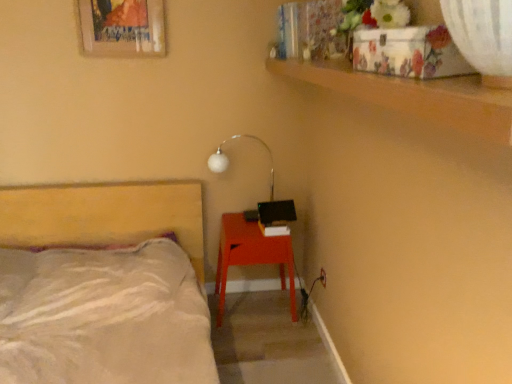
Question: Is wooden picture frame at upper left not within white glossy lamp at upper center?

Choices:
 (A) yes
 (B) no

Answer: (A)

Question: Can you confirm if wooden picture frame at upper left is taller than white glossy lamp at upper center?

Choices:
 (A) yes
 (B) no

Answer: (B)

Question: Is wooden picture frame at upper left in front of white glossy lamp at upper center?

Choices:
 (A) no
 (B) yes

Answer: (B)

Question: From a real-world perspective, is wooden picture frame at upper left on white glossy lamp at upper center?

Choices:
 (A) no
 (B) yes

Answer: (B)

Question: From the image's perspective, is wooden picture frame at upper left located beneath white glossy lamp at upper center?

Choices:
 (A) no
 (B) yes

Answer: (A)

Question: Is white glossy lamp at upper center wider or thinner than beige fabric bed at left?

Choices:
 (A) thin
 (B) wide

Answer: (A)

Question: Is white glossy lamp at upper center situated inside beige fabric bed at left or outside?

Choices:
 (A) outside
 (B) inside

Answer: (A)

Question: Is point (223, 163) closer or farther from the camera than point (177, 281)?

Choices:
 (A) farther
 (B) closer

Answer: (A)

Question: From the image's perspective, relative to beige fabric bed at left, is white glossy lamp at upper center above or below?

Choices:
 (A) below
 (B) above

Answer: (B)

Question: Considering the positions of matte red nightstand at lower right and beige fabric bed at left in the image, is matte red nightstand at lower right bigger or smaller than beige fabric bed at left?

Choices:
 (A) small
 (B) big

Answer: (A)

Question: From a real-world perspective, relative to beige fabric bed at left, is matte red nightstand at lower right vertically above or below?

Choices:
 (A) above
 (B) below

Answer: (B)

Question: From the image's perspective, is matte red nightstand at lower right located above or below beige fabric bed at left?

Choices:
 (A) above
 (B) below

Answer: (A)

Question: Is matte red nightstand at lower right in front of or behind beige fabric bed at left in the image?

Choices:
 (A) behind
 (B) front

Answer: (A)

Question: Considering the positions of beige fabric bed at left and matte red nightstand at lower right in the image, is beige fabric bed at left taller or shorter than matte red nightstand at lower right?

Choices:
 (A) tall
 (B) short

Answer: (A)

Question: Is beige fabric bed at left bigger or smaller than matte red nightstand at lower right?

Choices:
 (A) small
 (B) big

Answer: (B)